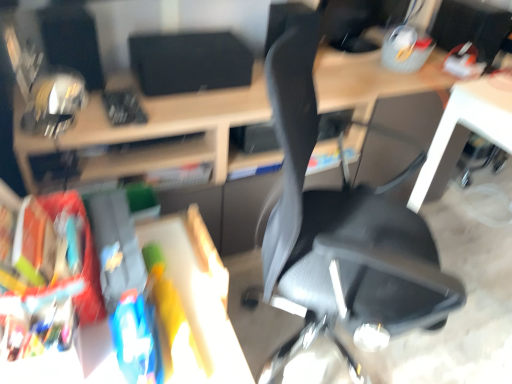
Question: From the image's perspective, would you say matte black desk at center is shown under matte black monitor at upper right, which is counted as the second computer monitor, starting from the left?

Choices:
 (A) yes
 (B) no

Answer: (A)

Question: From a real-world perspective, is matte black desk at center over matte black monitor at upper right, which is the first computer monitor from right to left?

Choices:
 (A) no
 (B) yes

Answer: (A)

Question: Can you confirm if matte black desk at center is shorter than matte black monitor at upper right, which is the first computer monitor from right to left?

Choices:
 (A) yes
 (B) no

Answer: (B)

Question: Considering the relative sizes of matte black desk at center and matte black monitor at upper right, which is counted as the second computer monitor, starting from the left, in the image provided, is matte black desk at center wider than matte black monitor at upper right, which is counted as the second computer monitor, starting from the left,?

Choices:
 (A) no
 (B) yes

Answer: (B)

Question: Does matte black desk at center have a larger size compared to matte black monitor at upper right, which is the first computer monitor from right to left?

Choices:
 (A) no
 (B) yes

Answer: (B)

Question: Would you say matte black desk at center is a long distance from matte black monitor at upper right, which is the first computer monitor from right to left?

Choices:
 (A) no
 (B) yes

Answer: (A)

Question: Can you confirm if black matte speaker at upper center, the first computer monitor from the left, is taller than black mesh chair at center?

Choices:
 (A) yes
 (B) no

Answer: (B)

Question: Are black matte speaker at upper center, the first computer monitor from the left, and black mesh chair at center far apart?

Choices:
 (A) no
 (B) yes

Answer: (A)

Question: Is black matte speaker at upper center, which is the 2th computer monitor from right to left, oriented towards black mesh chair at center?

Choices:
 (A) no
 (B) yes

Answer: (B)

Question: Is black mesh chair at center located within black matte speaker at upper center, the first computer monitor from the left?

Choices:
 (A) no
 (B) yes

Answer: (A)

Question: From a real-world perspective, is black matte speaker at upper center, which is the 2th computer monitor from right to left, located beneath black mesh chair at center?

Choices:
 (A) yes
 (B) no

Answer: (B)

Question: Is black matte speaker at upper center, the first computer monitor from the left, thinner than black mesh chair at center?

Choices:
 (A) yes
 (B) no

Answer: (A)

Question: From the image's perspective, does black matte speaker at upper center, which is the 2th computer monitor from right to left, appear lower than matte black desk at center?

Choices:
 (A) no
 (B) yes

Answer: (A)